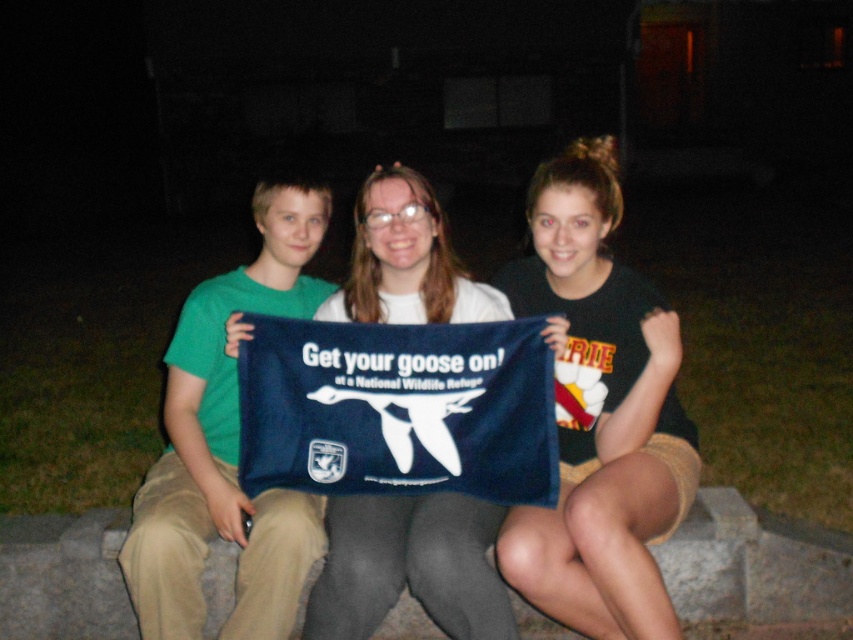
Based on the scene description, where is the dark blue fabric towel at center located in the image?

The dark blue fabric towel at center is located at point coordinates of 0.647 on the x axis and 0.703 on the y axis.

You are a photographer at the scene and want to ensure both the dark blue fabric towel at center and the white fabric towel at center are visible in your photo. Which towel should you focus on to capture both without cropping?

Focus on the dark blue fabric towel at center since it is taller than the white fabric towel at center, ensuring both are visible in the frame.